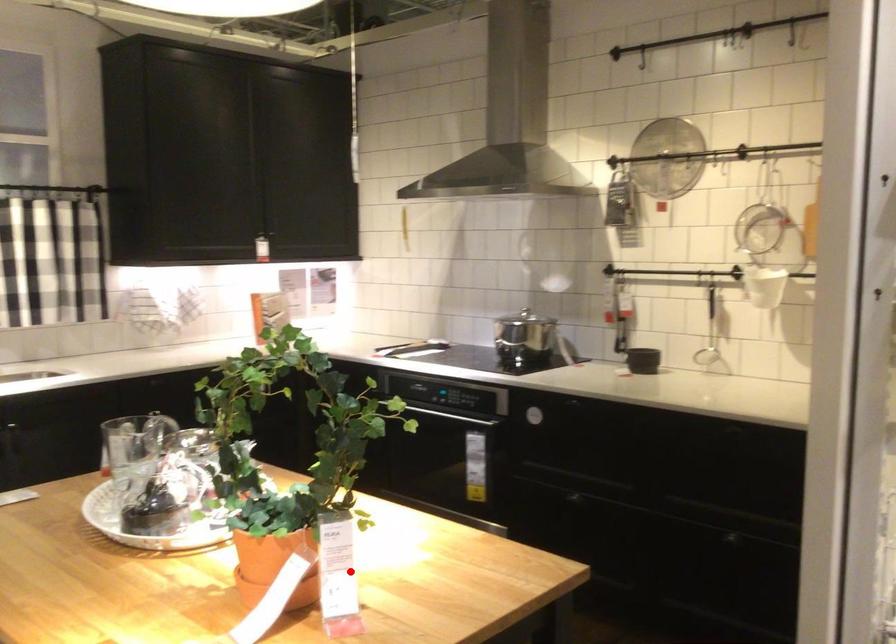
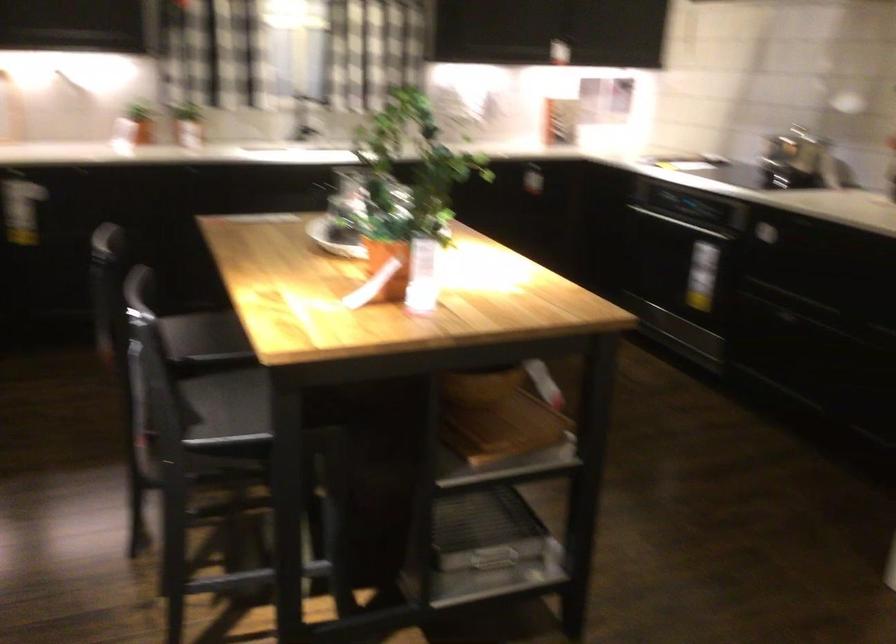
Find the pixel in the second image that matches the highlighted location in the first image.

(424, 275)